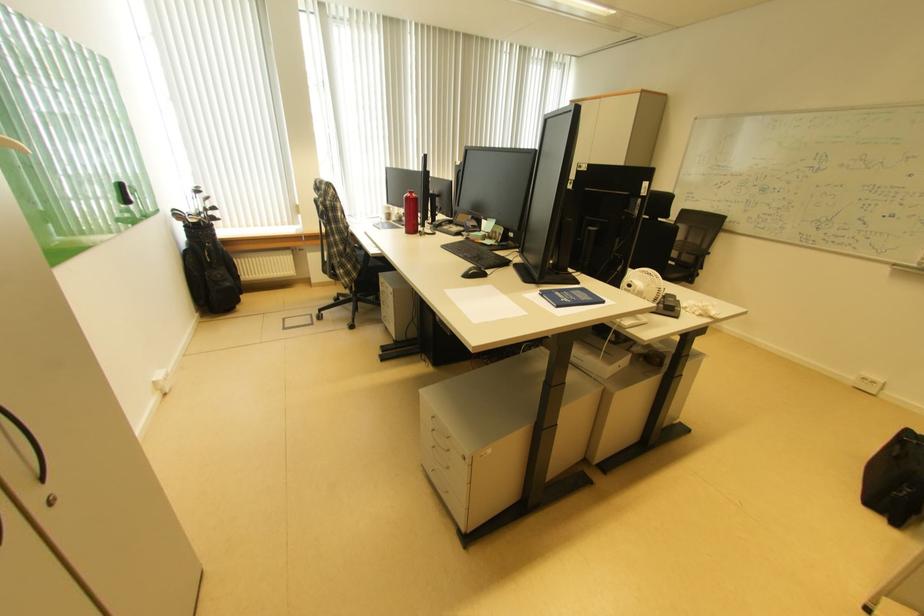
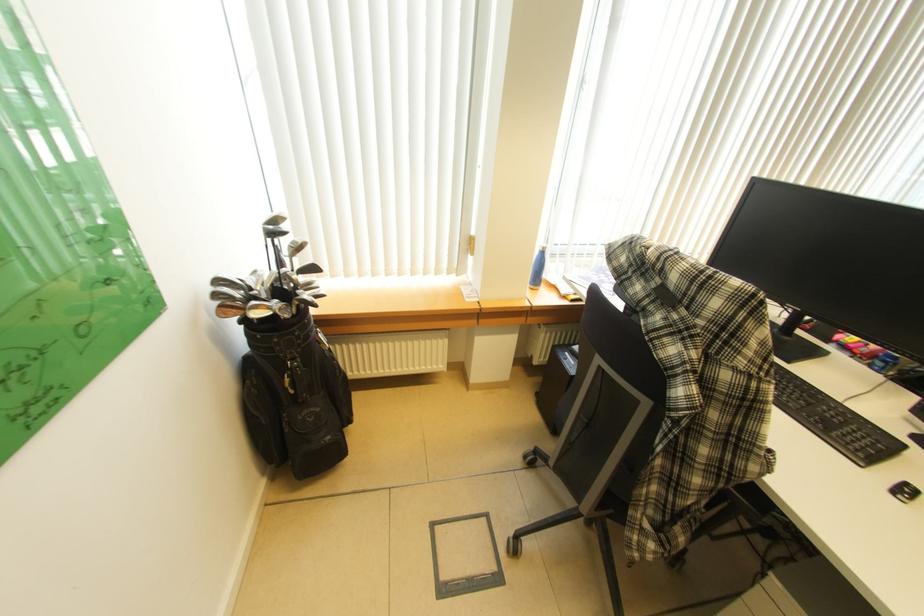
In a continuous first-person perspective shot, in which direction is the camera moving?

The cameraman moved toward left, forward.